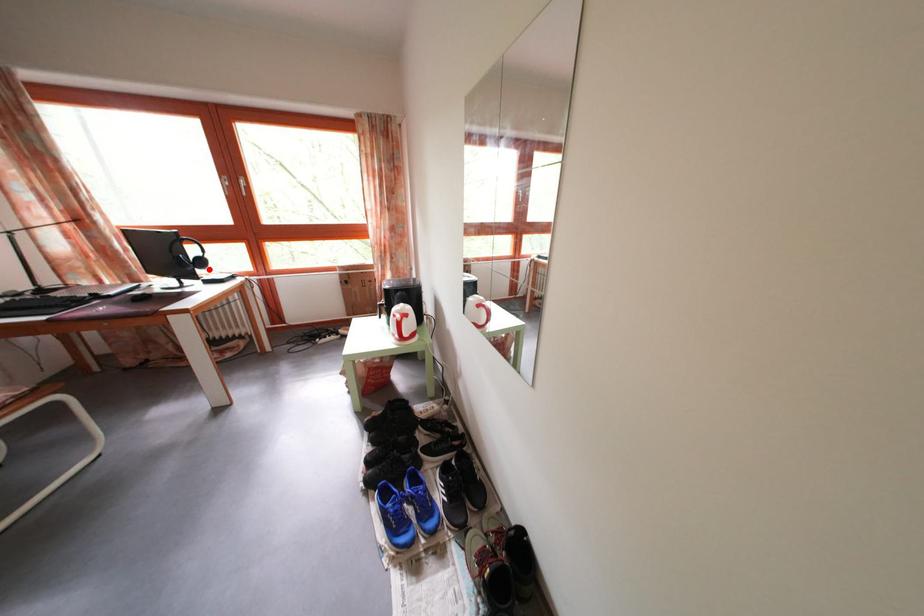
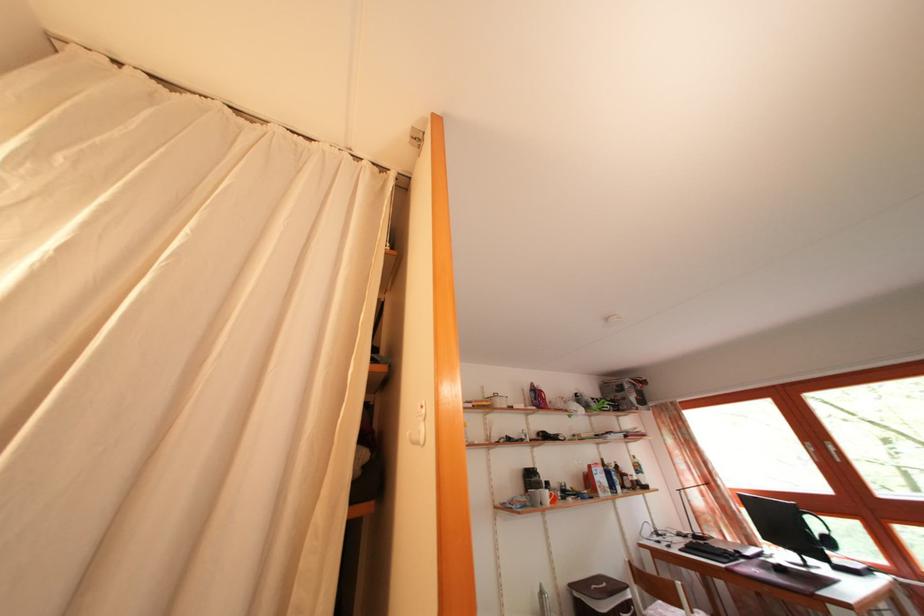
Question: I am providing you with two images of the same scene from different viewpoints. A red point is marked on the first image. Is the red point's position out of view in image 2?

Choices:
 (A) Yes
 (B) No

Answer: (B)